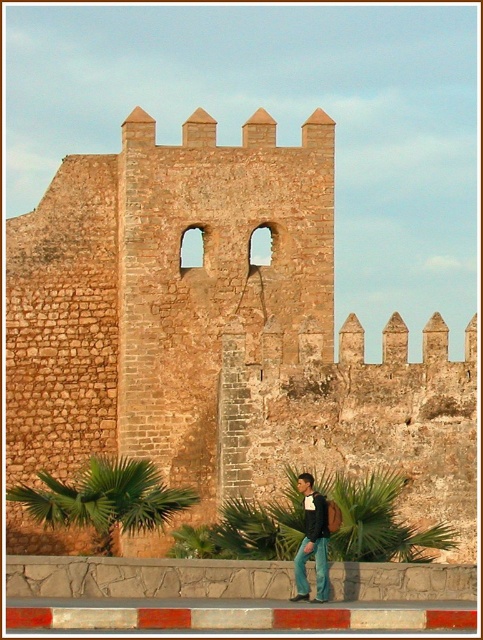
You are standing in front of the historic stone wall and notice a pair of jeans lying nearby. Based on the scene, where is the brown stone wall at center in relation to the jeans at lower right?

The brown stone wall at center is to the left of the jeans at lower right.

You are an architect analyzing the structural integrity of the brown stone wall at center. Based on its coordinates, can you determine if it is positioned centrally within the image?

The brown stone wall at center is positioned at coordinates point [218,330], which is very close to the center of the image, so yes, it is centrally positioned.